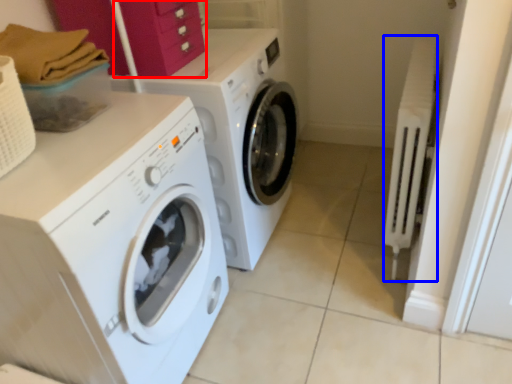
Question: Which object is closer to the camera taking this photo, drawer (highlighted by a red box) or radiator (highlighted by a blue box)?

Choices:
 (A) drawer
 (B) radiator

Answer: (A)